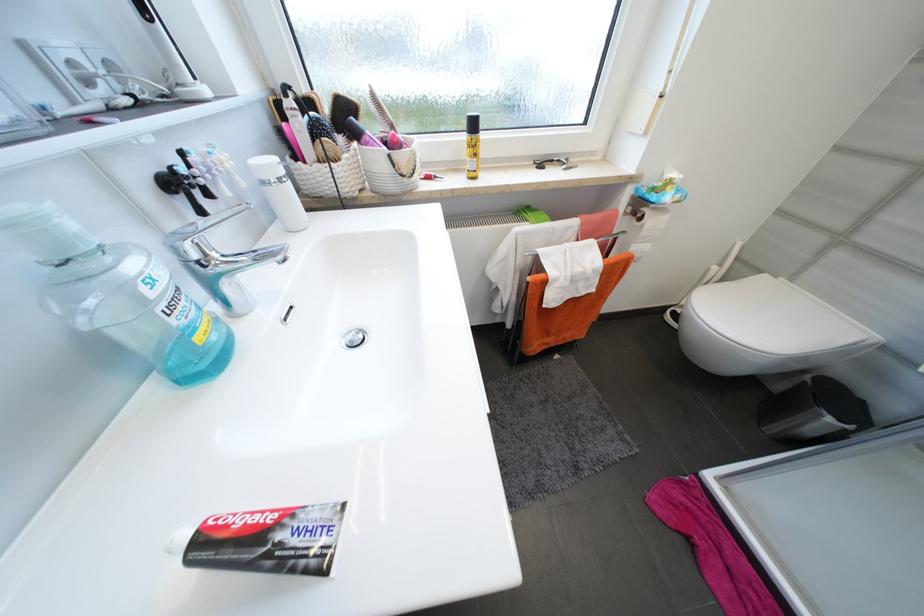
This screenshot has height=616, width=924. I want to click on toothpaste tube, so click(268, 541).